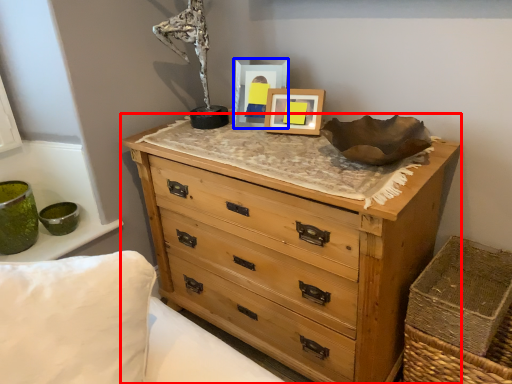
Question: Which object is closer to the camera taking this photo, chest of drawers (highlighted by a red box) or picture frame (highlighted by a blue box)?

Choices:
 (A) chest of drawers
 (B) picture frame

Answer: (A)